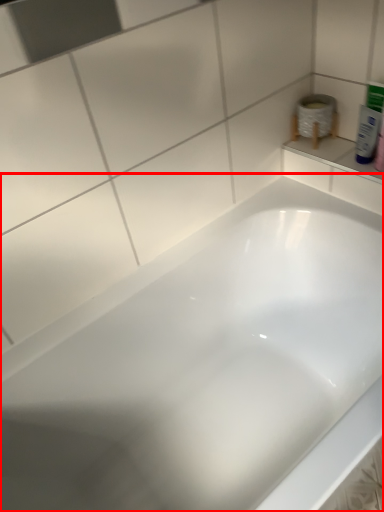
Question: Where is bathtub (annotated by the red box) located in relation to mouthwash in the image?

Choices:
 (A) right
 (B) left

Answer: (B)